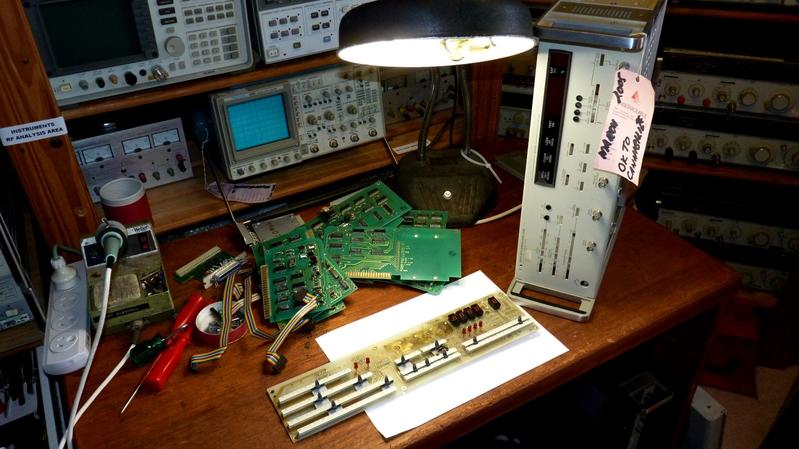
Identify the location of board. (411, 344).